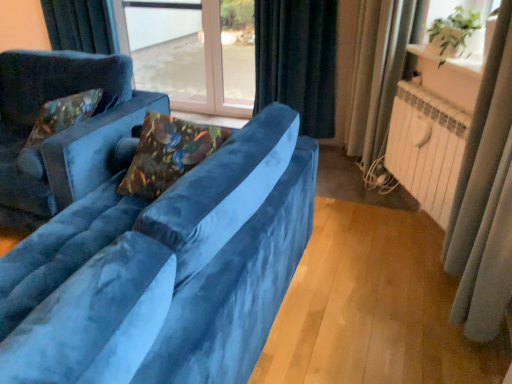
Question: Is velvet floral pillow at center, arranged as the 2th pillow when viewed from the left, not within green leafy plant at upper right, arranged as the second window screen when viewed from the back?

Choices:
 (A) no
 (B) yes

Answer: (B)

Question: From a real-world perspective, is velvet floral pillow at center, the 2th pillow in the back-to-front sequence, over green leafy plant at upper right, positioned as the first window screen in right-to-left order?

Choices:
 (A) no
 (B) yes

Answer: (A)

Question: Is velvet floral pillow at center, the 2th pillow in the back-to-front sequence, positioned in front of green leafy plant at upper right, the first window screen viewed from the front?

Choices:
 (A) yes
 (B) no

Answer: (A)

Question: Is green leafy plant at upper right, the first window screen viewed from the front, at the back of velvet floral pillow at center, placed as the first pillow when sorted from front to back?

Choices:
 (A) no
 (B) yes

Answer: (A)

Question: Is the surface of velvet floral pillow at center, arranged as the 2th pillow when viewed from the left, in direct contact with green leafy plant at upper right, positioned as the first window screen in right-to-left order?

Choices:
 (A) yes
 (B) no

Answer: (B)

Question: Would you say transparent glass window screen at center, placed as the 2th window screen when sorted from right to left, is inside or outside velvet floral pillow at left, the first pillow in the left-to-right sequence?

Choices:
 (A) outside
 (B) inside

Answer: (A)

Question: Does point click(x=232, y=4) appear closer or farther from the camera than point click(x=64, y=117)?

Choices:
 (A) farther
 (B) closer

Answer: (A)

Question: Considering the positions of transparent glass window screen at center, placed as the 2th window screen when sorted from right to left, and velvet floral pillow at left, the first pillow in the left-to-right sequence, in the image, is transparent glass window screen at center, placed as the 2th window screen when sorted from right to left, taller or shorter than velvet floral pillow at left, the first pillow in the left-to-right sequence,?

Choices:
 (A) tall
 (B) short

Answer: (A)

Question: Looking at their shapes, would you say transparent glass window screen at center, which is the first window screen in left-to-right order, is wider or thinner than velvet floral pillow at left, the first pillow in the left-to-right sequence?

Choices:
 (A) thin
 (B) wide

Answer: (A)

Question: Based on their positions, is velvet blue couch at left, the second studio couch positioned from the right, located to the left or right of transparent glass window at center?

Choices:
 (A) right
 (B) left

Answer: (B)

Question: Is point (117, 132) closer or farther from the camera than point (215, 79)?

Choices:
 (A) farther
 (B) closer

Answer: (B)

Question: Is velvet blue couch at left, arranged as the 1th studio couch when viewed from the left, in front of or behind transparent glass window at center in the image?

Choices:
 (A) front
 (B) behind

Answer: (A)

Question: Is velvet blue couch at left, the second studio couch positioned from the right, inside the boundaries of transparent glass window at center, or outside?

Choices:
 (A) inside
 (B) outside

Answer: (B)

Question: Relative to velvet blue couch at left, arranged as the 1th studio couch when viewed from the left, is velvet floral pillow at center, the 2th pillow in the back-to-front sequence, in front or behind?

Choices:
 (A) behind
 (B) front

Answer: (B)

Question: From a real-world perspective, is velvet floral pillow at center, the 2th pillow in the back-to-front sequence, positioned above or below velvet blue couch at left, the second studio couch positioned from the right?

Choices:
 (A) below
 (B) above

Answer: (B)